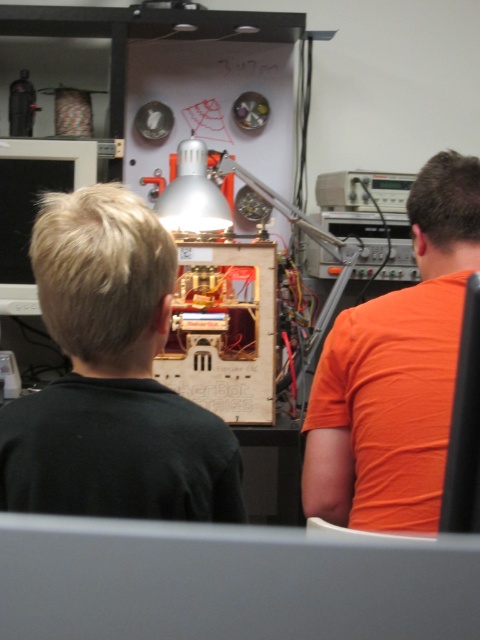
Question: Which of these objects is positioned closest to the black matte boy at center?

Choices:
 (A) orange matte computer monitor at upper right
 (B) matte black monitor at left

Answer: (A)

Question: Can you confirm if black matte boy at center is smaller than orange matte computer monitor at upper right?

Choices:
 (A) yes
 (B) no

Answer: (B)

Question: Does orange cotton shirt at right lie in front of matte black monitor at left?

Choices:
 (A) yes
 (B) no

Answer: (A)

Question: Which point appears closest to the camera in this image?

Choices:
 (A) (456, 424)
 (B) (466, 204)
 (C) (218, 474)
 (D) (11, 282)

Answer: (A)

Question: Is black matte boy at center further to camera compared to orange cotton shirt at right?

Choices:
 (A) no
 (B) yes

Answer: (A)

Question: Which point is farther to the camera?

Choices:
 (A) orange cotton shirt at right
 (B) black matte boy at center

Answer: (A)